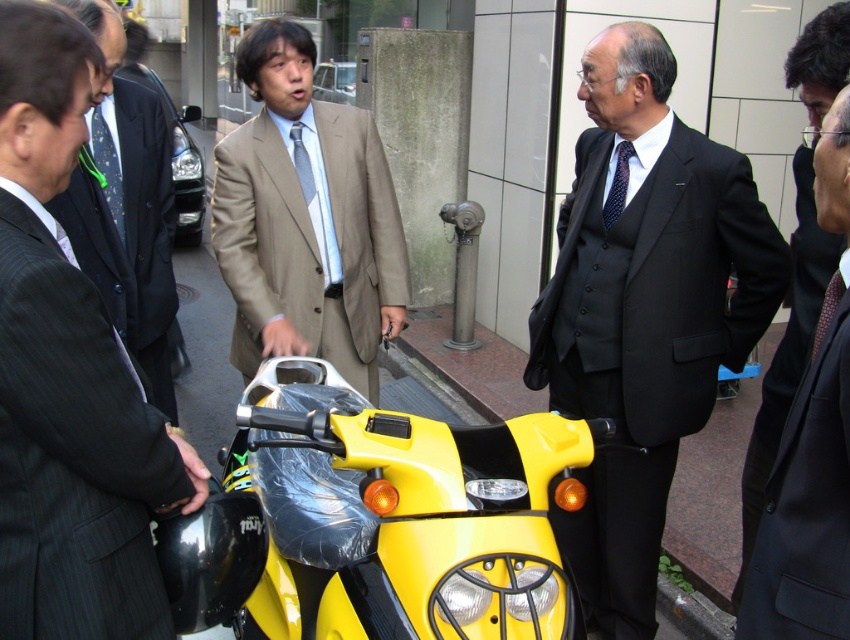
Question: Which is nearer to the matte beige suit at center?

Choices:
 (A) matte black suit at left
 (B) black suit at center

Answer: (A)

Question: Which point appears farthest from the camera in this image?

Choices:
 (A) (757, 484)
 (B) (88, 634)

Answer: (A)

Question: Estimate the real-world distances between objects in this image. Which object is farther from the matte beige suit at center?

Choices:
 (A) black suit at center
 (B) matte black suit at left

Answer: (A)

Question: Does yellow glossy motorcycle at center appear under matte gray suit at center?

Choices:
 (A) yes
 (B) no

Answer: (A)

Question: Is matte beige suit at center positioned at the back of dark blue suit at right?

Choices:
 (A) no
 (B) yes

Answer: (B)

Question: Is yellow glossy motorcycle at center thinner than matte black suit at left?

Choices:
 (A) no
 (B) yes

Answer: (A)